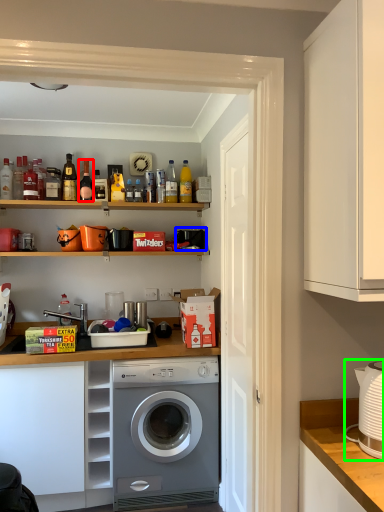
Question: Based on their relative distances, which object is farther from bottle (highlighted by a red box)? Choose from appliance (highlighted by a blue box) and appliance (highlighted by a green box).

Choices:
 (A) appliance
 (B) appliance

Answer: (B)